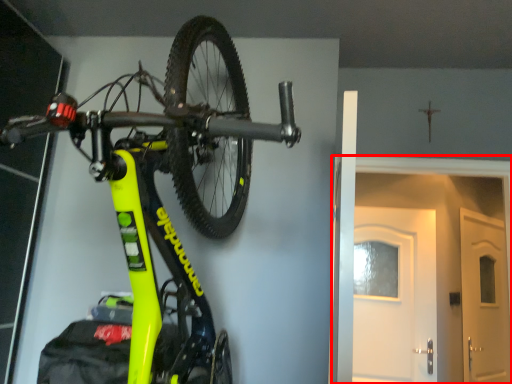
Question: Considering the relative positions of door (annotated by the red box) and bicycle in the image provided, where is door (annotated by the red box) located with respect to the staircase?

Choices:
 (A) left
 (B) right

Answer: (B)